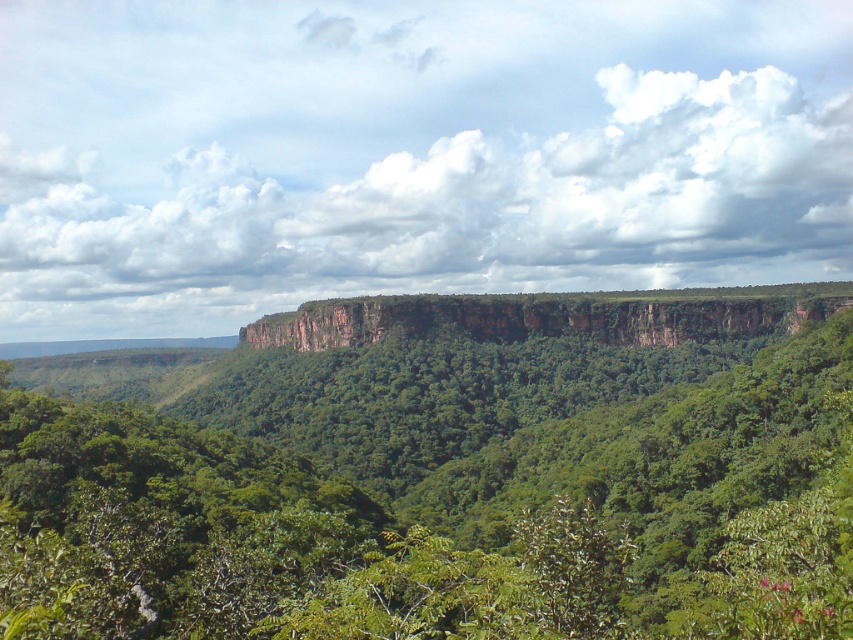
Question: Which of the following is the closest to the observer?

Choices:
 (A) (656, 316)
 (B) (273, 353)

Answer: (A)

Question: Which point is closer to the camera?

Choices:
 (A) (216, 440)
 (B) (641, 323)

Answer: (A)

Question: Is green leafy tree at center bigger than brown rocky cliff at center?

Choices:
 (A) no
 (B) yes

Answer: (B)

Question: Where is green leafy tree at center located in relation to brown rocky cliff at center in the image?

Choices:
 (A) below
 (B) above

Answer: (A)

Question: Can you confirm if green leafy tree at center is smaller than brown rocky cliff at center?

Choices:
 (A) yes
 (B) no

Answer: (B)